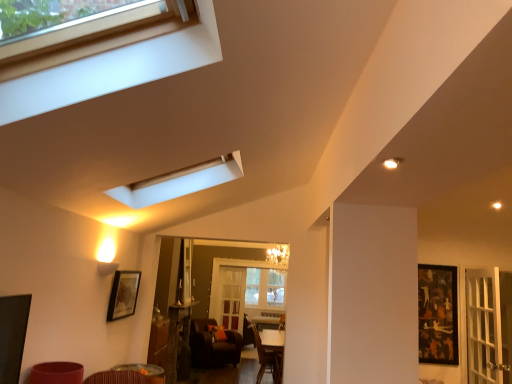
Question: Is brown leather chair at lower center outside matte black picture frame at lower left, placed as the 1th picture frame when sorted from front to back?

Choices:
 (A) no
 (B) yes

Answer: (B)

Question: Can you confirm if brown leather chair at lower center is taller than matte black picture frame at lower left, placed as the 2th picture frame when sorted from right to left?

Choices:
 (A) no
 (B) yes

Answer: (B)

Question: From a real-world perspective, is brown leather chair at lower center positioned under matte black picture frame at lower left, placed as the 2th picture frame when sorted from right to left, based on gravity?

Choices:
 (A) no
 (B) yes

Answer: (B)

Question: Does brown leather chair at lower center have a lesser height compared to matte black picture frame at lower left, placed as the 1th picture frame when sorted from front to back?

Choices:
 (A) no
 (B) yes

Answer: (A)

Question: Is brown leather chair at lower center closer to the viewer compared to matte black picture frame at lower left, placed as the 2th picture frame when sorted from right to left?

Choices:
 (A) no
 (B) yes

Answer: (A)

Question: Considering the positions of matte black picture frame at lower left, placed as the 2th picture frame when sorted from right to left, and wooden frame window at upper left in the image, is matte black picture frame at lower left, placed as the 2th picture frame when sorted from right to left, taller or shorter than wooden frame window at upper left?

Choices:
 (A) tall
 (B) short

Answer: (A)

Question: Is matte black picture frame at lower left, placed as the 2th picture frame when sorted from right to left, spatially inside wooden frame window at upper left, or outside of it?

Choices:
 (A) inside
 (B) outside

Answer: (B)

Question: Is matte black picture frame at lower left, acting as the 1th picture frame starting from the left, in front of or behind wooden frame window at upper left in the image?

Choices:
 (A) front
 (B) behind

Answer: (B)

Question: From a real-world perspective, relative to wooden frame window at upper left, is matte black picture frame at lower left, placed as the 1th picture frame when sorted from front to back, vertically above or below?

Choices:
 (A) above
 (B) below

Answer: (B)

Question: Is point (218, 57) positioned closer to the camera than point (231, 364)?

Choices:
 (A) farther
 (B) closer

Answer: (B)

Question: From the image's perspective, is wooden frame window at upper left positioned above or below brown leather chair at lower center?

Choices:
 (A) below
 (B) above

Answer: (B)

Question: Is wooden frame window at upper left taller or shorter than brown leather chair at lower center?

Choices:
 (A) short
 (B) tall

Answer: (A)

Question: Is wooden frame window at upper left to the left or to the right of brown leather chair at lower center in the image?

Choices:
 (A) right
 (B) left

Answer: (A)

Question: From a real-world perspective, is clear glass screen door at center above or below dark brown leather armchair at center?

Choices:
 (A) above
 (B) below

Answer: (A)

Question: In the image, is clear glass screen door at center on the left side or the right side of dark brown leather armchair at center?

Choices:
 (A) left
 (B) right

Answer: (A)